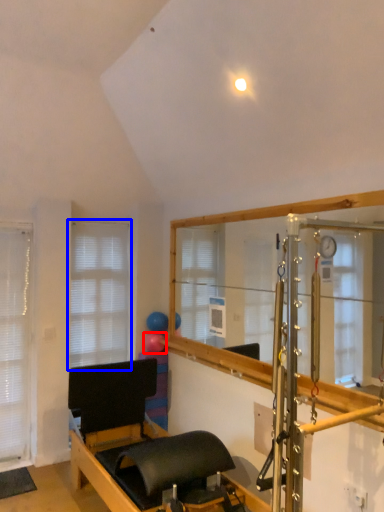
Question: Which of the following is the closest to the observer, balloon (highlighted by a red box) or window (highlighted by a blue box)?

Choices:
 (A) balloon
 (B) window

Answer: (B)